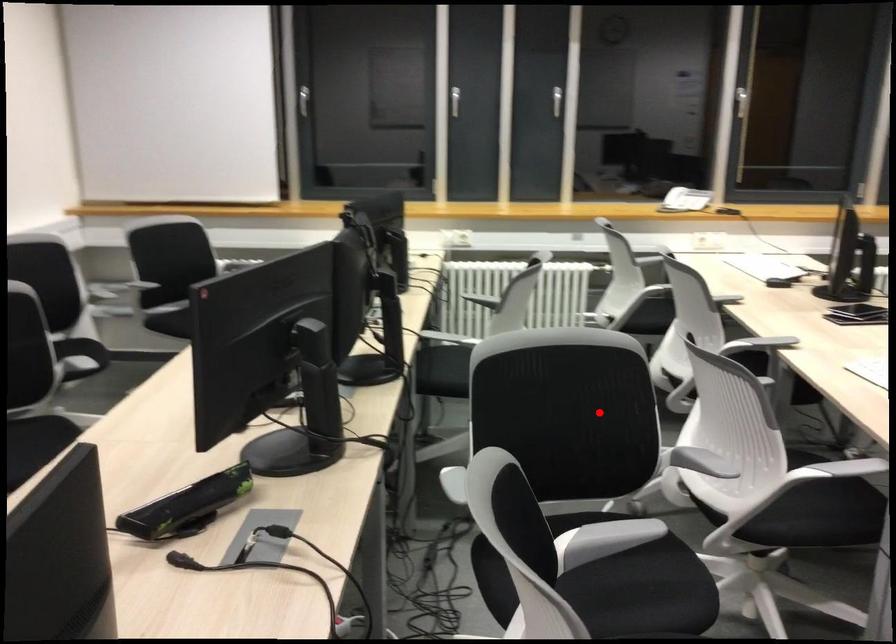
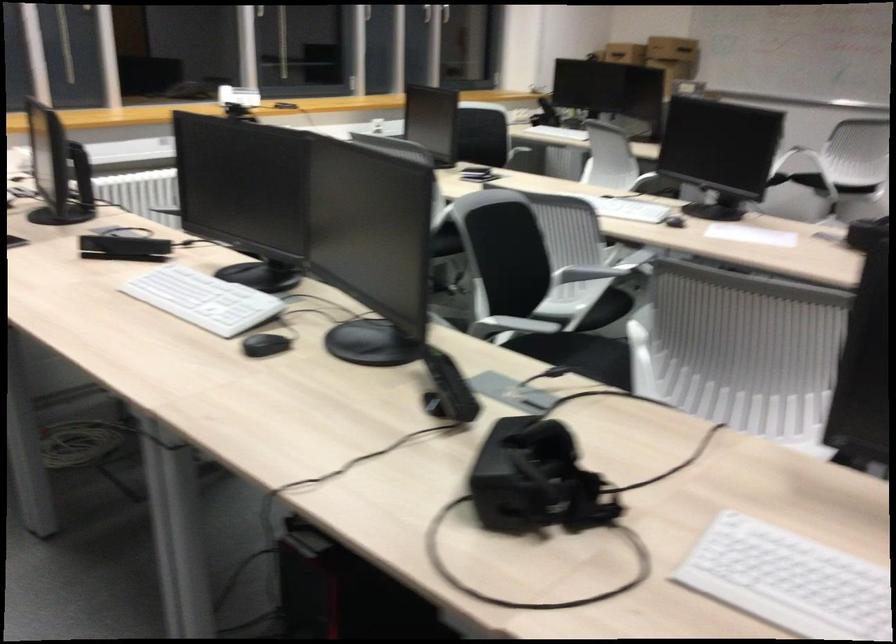
The point at the highlighted location is marked in the first image. Where is the corresponding point in the second image?

(510, 257)